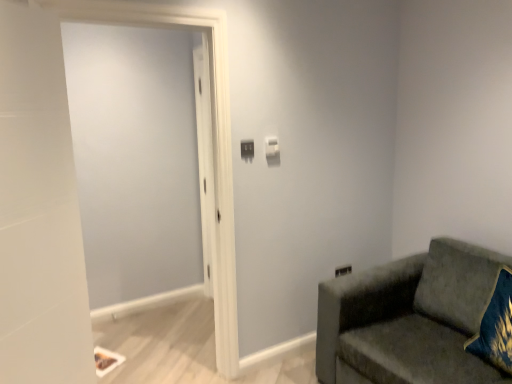
Question: From a real-world perspective, is white plastic light switch at upper center, the 2th light switch when ordered from left to right, above or below matte plastic light switch at center, which appears as the first light switch when viewed from the front?

Choices:
 (A) below
 (B) above

Answer: (B)

Question: Considering the positions of white plastic light switch at upper center, the second light switch from the front, and matte plastic light switch at center, arranged as the 2th light switch when viewed from the right, in the image, is white plastic light switch at upper center, the second light switch from the front, wider or thinner than matte plastic light switch at center, arranged as the 2th light switch when viewed from the right,?

Choices:
 (A) wide
 (B) thin

Answer: (A)

Question: Estimate the real-world distances between objects in this image. Which object is closer to the matte plastic light switch at center, which appears as the first light switch when viewed from the front?

Choices:
 (A) white glossy door at left
 (B) white plastic light switch at upper center, the second light switch from the front
 (C) velvet blue pillow at lower right
 (D) velvet green couch at right

Answer: (B)

Question: Which is farther from the white glossy door at left?

Choices:
 (A) matte plastic light switch at center, arranged as the 2th light switch when viewed from the right
 (B) velvet green couch at right
 (C) velvet blue pillow at lower right
 (D) white plastic light switch at upper center, the 2th light switch when ordered from left to right

Answer: (C)